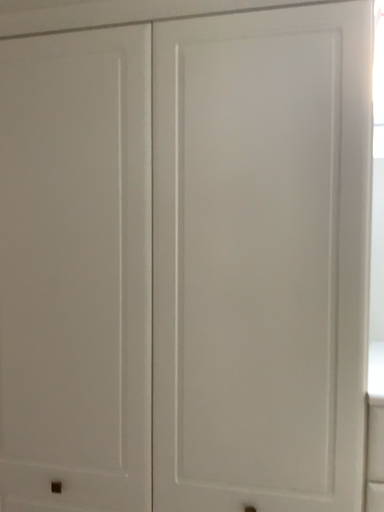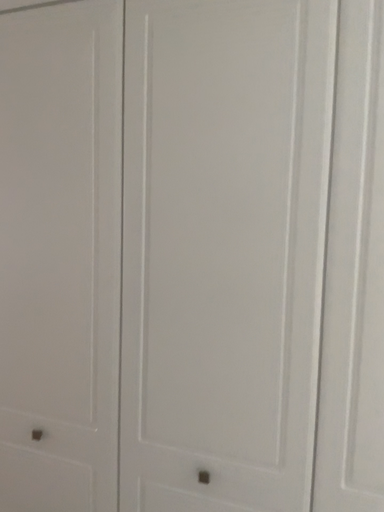
Question: Which way did the camera rotate in the video?

Choices:
 (A) rotated left
 (B) rotated right

Answer: (A)